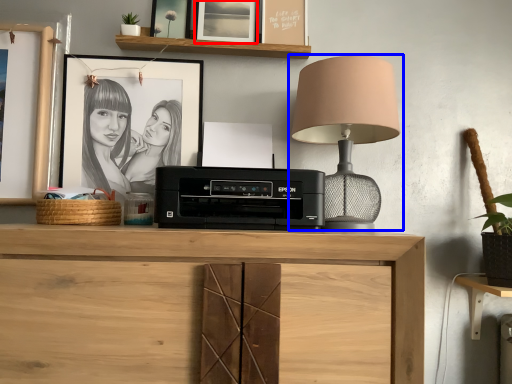
Question: Among these objects, which one is nearest to the camera, picture frame (highlighted by a red box) or lamp (highlighted by a blue box)?

Choices:
 (A) picture frame
 (B) lamp

Answer: (B)